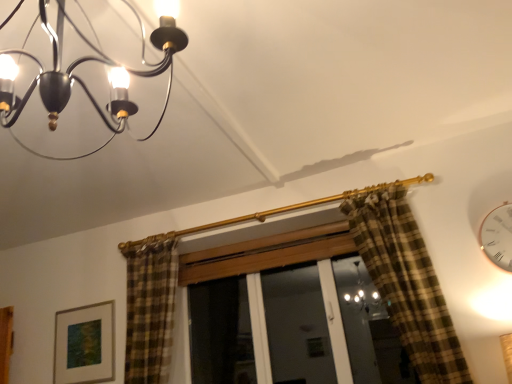
Question: Is matte black chandelier at upper left aimed at white glossy clock at upper right?

Choices:
 (A) yes
 (B) no

Answer: (B)

Question: Is matte black chandelier at upper left thinner than white glossy clock at upper right?

Choices:
 (A) no
 (B) yes

Answer: (A)

Question: Considering the relative sizes of matte black chandelier at upper left and white glossy clock at upper right in the image provided, is matte black chandelier at upper left wider than white glossy clock at upper right?

Choices:
 (A) yes
 (B) no

Answer: (A)

Question: Can you confirm if matte black chandelier at upper left is smaller than white glossy clock at upper right?

Choices:
 (A) yes
 (B) no

Answer: (B)

Question: Is matte black chandelier at upper left positioned far away from white glossy clock at upper right?

Choices:
 (A) no
 (B) yes

Answer: (B)

Question: Does matte black chandelier at upper left have a larger size compared to white glossy clock at upper right?

Choices:
 (A) no
 (B) yes

Answer: (B)

Question: Considering the relative sizes of matte gold picture frame at lower left and matte black chandelier at upper left in the image provided, is matte gold picture frame at lower left wider than matte black chandelier at upper left?

Choices:
 (A) no
 (B) yes

Answer: (A)

Question: Could you tell me if matte gold picture frame at lower left is facing matte black chandelier at upper left?

Choices:
 (A) yes
 (B) no

Answer: (B)

Question: Is matte gold picture frame at lower left thinner than matte black chandelier at upper left?

Choices:
 (A) yes
 (B) no

Answer: (A)

Question: Would you say matte gold picture frame at lower left contains matte black chandelier at upper left?

Choices:
 (A) no
 (B) yes

Answer: (A)

Question: Considering the relative sizes of matte gold picture frame at lower left and matte black chandelier at upper left in the image provided, is matte gold picture frame at lower left bigger than matte black chandelier at upper left?

Choices:
 (A) yes
 (B) no

Answer: (B)

Question: Is matte gold picture frame at lower left positioned with its back to matte black chandelier at upper left?

Choices:
 (A) no
 (B) yes

Answer: (A)

Question: Considering the relative positions of matte black chandelier at upper left and matte gold picture frame at lower left in the image provided, is matte black chandelier at upper left to the left of matte gold picture frame at lower left from the viewer's perspective?

Choices:
 (A) yes
 (B) no

Answer: (B)